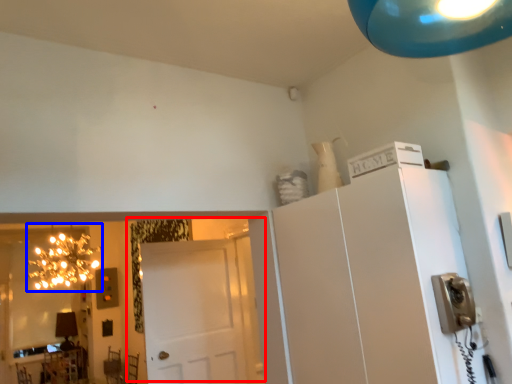
Question: Among these objects, which one is farthest to the camera, door (highlighted by a red box) or light fixture (highlighted by a blue box)?

Choices:
 (A) door
 (B) light fixture

Answer: (B)